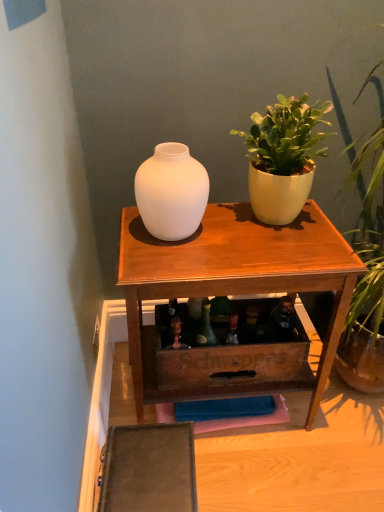
Locate an element on the screen. The image size is (384, 512). vacant space in front of matte white vase at center is located at coordinates (174, 265).